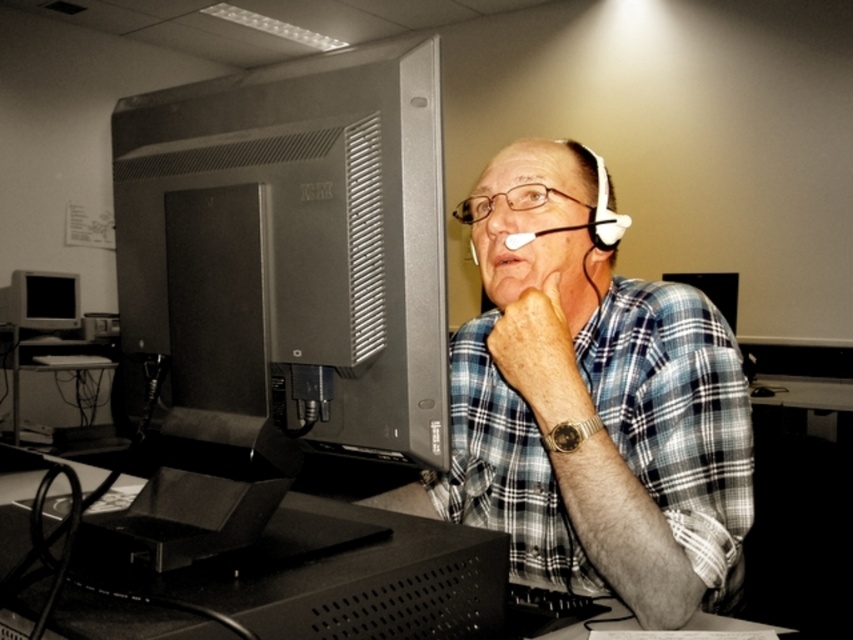
Based on the photo, is metallic gray monitor at center-left positioned before plaid shirt at center?

Yes, metallic gray monitor at center-left is in front of plaid shirt at center.

Is the position of metallic gray monitor at center-left more distant than that of plaid shirt at center?

No.

Locate an element on the screen. The width and height of the screenshot is (853, 640). metallic gray monitor at center-left is located at coordinates (281, 284).

From the picture: Does clear plastic glasses at center have a smaller size compared to matte skin nose at center?

Incorrect, clear plastic glasses at center is not smaller in size than matte skin nose at center.

Who is shorter, clear plastic glasses at center or matte skin nose at center?

matte skin nose at center is shorter.

Which is in front, point (515, 209) or point (492, 202)?

Positioned in front is point (515, 209).

Find the location of a particular element. The width and height of the screenshot is (853, 640). clear plastic glasses at center is located at coordinates pyautogui.click(x=508, y=202).

Which is in front, point (527, 216) or point (74, 374)?

Positioned in front is point (527, 216).

Consider the image. Who is positioned more to the left, plaid shirt at center or metallic gray computer desk at lower left?

metallic gray computer desk at lower left is more to the left.

Locate an element on the screen. plaid shirt at center is located at coordinates (601, 429).

Locate an element on the screen. The image size is (853, 640). plaid shirt at center is located at coordinates (601, 429).